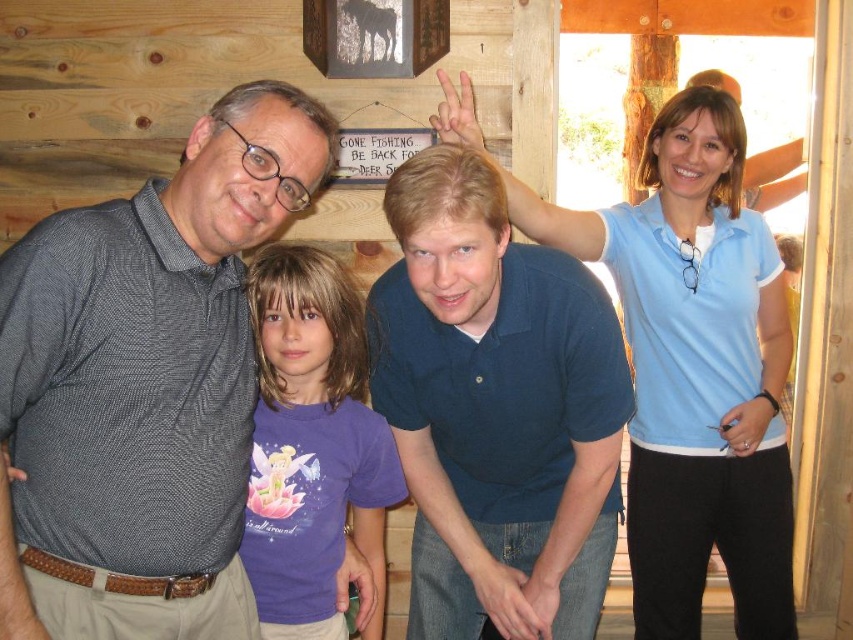
Who is shorter, matte gray shirt at left or dark blue polo shirt at center?

Standing shorter between the two is dark blue polo shirt at center.

Does matte gray shirt at left have a lesser height compared to dark blue polo shirt at center?

In fact, matte gray shirt at left may be taller than dark blue polo shirt at center.

Is point (282, 211) closer to camera compared to point (544, 477)?

Yes, point (282, 211) is closer to viewer.

You are a GUI agent. You are given a task and a screenshot of the screen. Output one action in this format:
    pyautogui.click(x=<x>, y=<y>)
    Task: Click on the matte gray shirt at left
    
    Given the screenshot: What is the action you would take?
    pyautogui.click(x=144, y=378)

Is matte gray shirt at left below purple cotton shirt at center?

No.

Does matte gray shirt at left have a lesser width compared to purple cotton shirt at center?

No, matte gray shirt at left is not thinner than purple cotton shirt at center.

Which is in front, point (206, 545) or point (247, 513)?

Point (206, 545)

Locate an element on the screen. The width and height of the screenshot is (853, 640). matte gray shirt at left is located at coordinates (144, 378).

Is point (440, 346) less distant than point (300, 378)?

Yes, it is.

Does point (442, 179) come behind point (355, 307)?

No, it is not.

Identify the location of dark blue polo shirt at center. (496, 410).

Find the location of `dark blue polo shirt at center`. dark blue polo shirt at center is located at coordinates (496, 410).